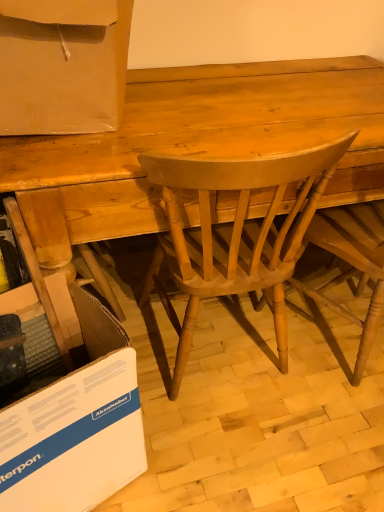
Find the location of a particular element. This screenshot has height=512, width=384. light brown wood chair at center, arranged as the 2th chair when viewed from the right is located at coordinates (234, 233).

Find the location of a particular element. The height and width of the screenshot is (512, 384). light brown wood chair at center, which is the 1th chair from left to right is located at coordinates (234, 233).

At what (x,y) coordinates should I click in order to perform the action: click on desk that is on the left side of light brown wood chair at center, the second chair viewed from the left. Please return your answer as a coordinate pair (x, y). Looking at the image, I should click on (194, 144).

Which of these two, light brown wood chair at center, arranged as the first chair when viewed from the right, or light brown wood desk at center, is bigger?

light brown wood desk at center is bigger.

Considering the relative sizes of light brown wood chair at center, the second chair viewed from the left, and light brown wood desk at center in the image provided, is light brown wood chair at center, the second chair viewed from the left, taller than light brown wood desk at center?

Indeed, light brown wood chair at center, the second chair viewed from the left, has a greater height compared to light brown wood desk at center.

In the image, is white cardboard at lower left positioned in front of or behind light brown wood chair at center, the second chair viewed from the left?

Clearly, white cardboard at lower left is in front of light brown wood chair at center, the second chair viewed from the left.

This screenshot has width=384, height=512. I want to click on cardboard box located underneath the light brown wood chair at center, arranged as the first chair when viewed from the right (from a real-world perspective), so click(x=76, y=426).

Which of these two, white cardboard at lower left or light brown wood chair at center, arranged as the first chair when viewed from the right, stands shorter?

With less height is white cardboard at lower left.

Which is farther, (85,321) or (369,258)?

The point (369,258) is more distant.

Consider the image. Can you tell me how much light brown wood chair at center, which is the 1th chair from left to right, and light brown wood chair at center, arranged as the first chair when viewed from the right, differ in facing direction?

The angle between the facing direction of light brown wood chair at center, which is the 1th chair from left to right, and the facing direction of light brown wood chair at center, arranged as the first chair when viewed from the right, is 22 degrees.

Can you see light brown wood chair at center, which is the 1th chair from left to right, touching light brown wood chair at center, arranged as the first chair when viewed from the right?

No, light brown wood chair at center, which is the 1th chair from left to right, is not with light brown wood chair at center, arranged as the first chair when viewed from the right.

From the image's perspective, is light brown wood chair at center, which is the 1th chair from left to right, over light brown wood chair at center, the second chair viewed from the left?

Actually, light brown wood chair at center, which is the 1th chair from left to right, appears below light brown wood chair at center, the second chair viewed from the left, in the image.

From a real-world perspective, who is located higher, light brown wood chair at center, which is the 1th chair from left to right, or light brown wood chair at center, the second chair viewed from the left?

In real-world perspective, light brown wood chair at center, which is the 1th chair from left to right, is above.

Is matte cardboard box at upper left wider than light brown wood desk at center?

No.

From the image's perspective, who appears lower, matte cardboard box at upper left or light brown wood desk at center?

light brown wood desk at center appears lower in the image.

Between matte cardboard box at upper left and light brown wood desk at center, which one has smaller size?

Smaller between the two is matte cardboard box at upper left.

Is matte cardboard box at upper left next to light brown wood desk at center?

matte cardboard box at upper left and light brown wood desk at center are not in contact.

Which of these two, light brown wood chair at center, arranged as the first chair when viewed from the right, or light brown wood chair at center, arranged as the 2th chair when viewed from the right, is smaller?

Smaller between the two is light brown wood chair at center, arranged as the 2th chair when viewed from the right.

Measure the distance between light brown wood chair at center, arranged as the first chair when viewed from the right, and light brown wood chair at center, which is the 1th chair from left to right.

light brown wood chair at center, arranged as the first chair when viewed from the right, is 12.36 inches from light brown wood chair at center, which is the 1th chair from left to right.

Considering the relative positions of light brown wood chair at center, the second chair viewed from the left, and light brown wood chair at center, which is the 1th chair from left to right, in the image provided, is light brown wood chair at center, the second chair viewed from the left, to the left or to the right of light brown wood chair at center, which is the 1th chair from left to right,?

Result: light brown wood chair at center, the second chair viewed from the left, is positioned on light brown wood chair at center, which is the 1th chair from left to right,'s right side.

From a real-world perspective, is light brown wood chair at center, the second chair viewed from the left, positioned above or below light brown wood chair at center, arranged as the 2th chair when viewed from the right?

From a real-world perspective, light brown wood chair at center, the second chair viewed from the left, is physically below light brown wood chair at center, arranged as the 2th chair when viewed from the right.

Considering the sizes of objects light brown wood chair at center, which is the 1th chair from left to right, and white cardboard at lower left in the image provided, who is bigger, light brown wood chair at center, which is the 1th chair from left to right, or white cardboard at lower left?

light brown wood chair at center, which is the 1th chair from left to right, is bigger.

Is point (238, 251) positioned after point (58, 488)?

Yes, point (238, 251) is farther from viewer.

What's the angular difference between light brown wood chair at center, arranged as the 2th chair when viewed from the right, and white cardboard at lower left's facing directions?

160 degrees separate the facing orientations of light brown wood chair at center, arranged as the 2th chair when viewed from the right, and white cardboard at lower left.

Is light brown wood chair at center, arranged as the 2th chair when viewed from the right, oriented towards white cardboard at lower left?

No, light brown wood chair at center, arranged as the 2th chair when viewed from the right, is not aimed at white cardboard at lower left.

Is light brown wood desk at center to the left of white cardboard at lower left from the viewer's perspective?

In fact, light brown wood desk at center is to the right of white cardboard at lower left.

Considering the sizes of objects light brown wood desk at center and white cardboard at lower left in the image provided, who is wider, light brown wood desk at center or white cardboard at lower left?

light brown wood desk at center is wider.

Considering the positions of point (83, 148) and point (100, 410), is point (83, 148) closer or farther from the camera than point (100, 410)?

Point (83, 148) is farther from the camera than point (100, 410).

Are light brown wood desk at center and white cardboard at lower left beside each other?

No, light brown wood desk at center is not making contact with white cardboard at lower left.

In the image, there is a light brown wood chair at center, the second chair viewed from the left. Where is `desk below it (from a real-world perspective)`? Image resolution: width=384 pixels, height=512 pixels. desk below it (from a real-world perspective) is located at coordinates (194, 144).

From a real-world perspective, starting from the white cardboard at lower left, which chair is the 1st one vertically above it? Please provide its 2D coordinates.

[(351, 264)]

Considering their positions, is light brown wood chair at center, which is the 1th chair from left to right, positioned further to light brown wood chair at center, the second chair viewed from the left, than matte cardboard box at upper left?

The object further to light brown wood chair at center, the second chair viewed from the left, is matte cardboard box at upper left.

When comparing their distances from light brown wood chair at center, the second chair viewed from the left, does light brown wood chair at center, which is the 1th chair from left to right, or light brown wood desk at center seem further?

light brown wood desk at center lies further to light brown wood chair at center, the second chair viewed from the left, than the other object.

Looking at the image, which one is located further to light brown wood chair at center, which is the 1th chair from left to right, white cardboard at lower left or light brown wood desk at center?

The object further to light brown wood chair at center, which is the 1th chair from left to right, is white cardboard at lower left.

When comparing their distances from light brown wood desk at center, does light brown wood chair at center, arranged as the first chair when viewed from the right, or white cardboard at lower left seem further?

The object further to light brown wood desk at center is white cardboard at lower left.

Estimate the real-world distances between objects in this image. Which object is further from white cardboard at lower left, matte cardboard box at upper left or light brown wood chair at center, which is the 1th chair from left to right?

matte cardboard box at upper left is positioned further to the anchor white cardboard at lower left.

Looking at the image, which one is located closer to light brown wood chair at center, the second chair viewed from the left, light brown wood desk at center or light brown wood chair at center, arranged as the 2th chair when viewed from the right?

The object closer to light brown wood chair at center, the second chair viewed from the left, is light brown wood chair at center, arranged as the 2th chair when viewed from the right.

From the image, which object appears to be farther from white cardboard at lower left, light brown wood desk at center or light brown wood chair at center, which is the 1th chair from left to right?

Among the two, light brown wood desk at center is located further to white cardboard at lower left.

Considering their positions, is matte cardboard box at upper left positioned closer to light brown wood chair at center, the second chair viewed from the left, than light brown wood chair at center, arranged as the 2th chair when viewed from the right?

Among the two, light brown wood chair at center, arranged as the 2th chair when viewed from the right, is located nearer to light brown wood chair at center, the second chair viewed from the left.

Where is `desk between matte cardboard box at upper left and light brown wood chair at center, arranged as the first chair when viewed from the right, in the horizontal direction`? Image resolution: width=384 pixels, height=512 pixels. desk between matte cardboard box at upper left and light brown wood chair at center, arranged as the first chair when viewed from the right, in the horizontal direction is located at coordinates (194, 144).

Locate an element on the screen. chair between matte cardboard box at upper left and light brown wood chair at center, the second chair viewed from the left, in the horizontal direction is located at coordinates (234, 233).

The image size is (384, 512). In order to click on desk that lies between matte cardboard box at upper left and white cardboard at lower left from top to bottom in this screenshot , I will do `click(194, 144)`.

Find the location of `desk between light brown wood chair at center, which is the 1th chair from left to right, and light brown wood chair at center, arranged as the first chair when viewed from the right`. desk between light brown wood chair at center, which is the 1th chair from left to right, and light brown wood chair at center, arranged as the first chair when viewed from the right is located at coordinates (194, 144).